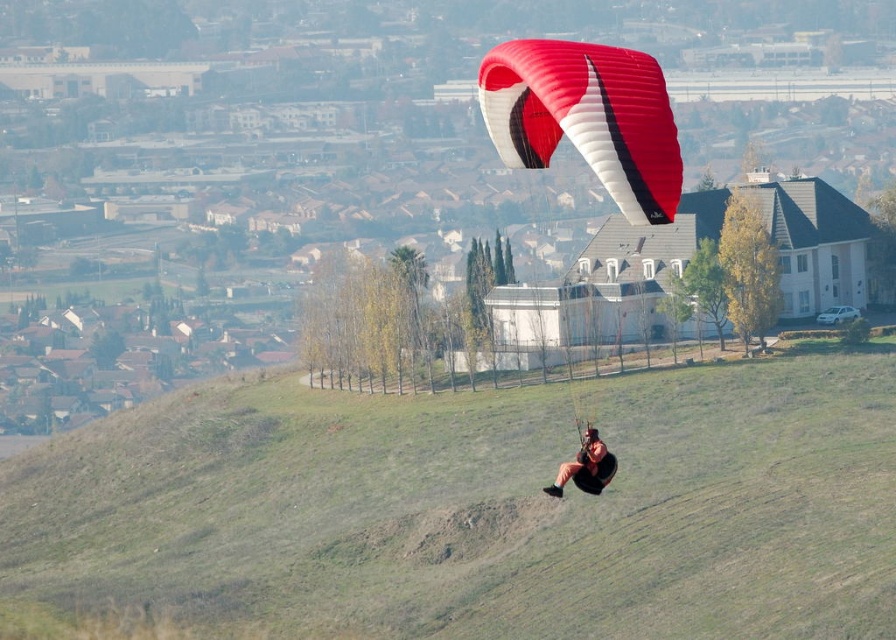
Is red/white parachute at center in front of matte black harness at center?

Yes, red/white parachute at center is closer to the viewer.

Looking at this image, can you confirm if red/white parachute at center is shorter than matte black harness at center?

In fact, red/white parachute at center may be taller than matte black harness at center.

Who is more forward, [664,147] or [604,449]?

Point [664,147]

Identify the location of red/white parachute at center. (586, 116).

Can you confirm if green grassy hillside at center is positioned to the right of matte black harness at center?

In fact, green grassy hillside at center is to the left of matte black harness at center.

Between green grassy hillside at center and matte black harness at center, which one appears on the right side from the viewer's perspective?

Positioned to the right is matte black harness at center.

Is point (337, 557) positioned before point (569, 477)?

That is False.

Where is `green grassy hillside at center`? green grassy hillside at center is located at coordinates (470, 512).

Between green grassy hillside at center and red/white parachute at center, which one appears on the left side from the viewer's perspective?

green grassy hillside at center is more to the left.

Does green grassy hillside at center appear under red/white parachute at center?

Yes, green grassy hillside at center is below red/white parachute at center.

You are a GUI agent. You are given a task and a screenshot of the screen. Output one action in this format:
    pyautogui.click(x=<x>, y=<y>)
    Task: Click on the green grassy hillside at center
    
    Given the screenshot: What is the action you would take?
    pyautogui.click(x=470, y=512)